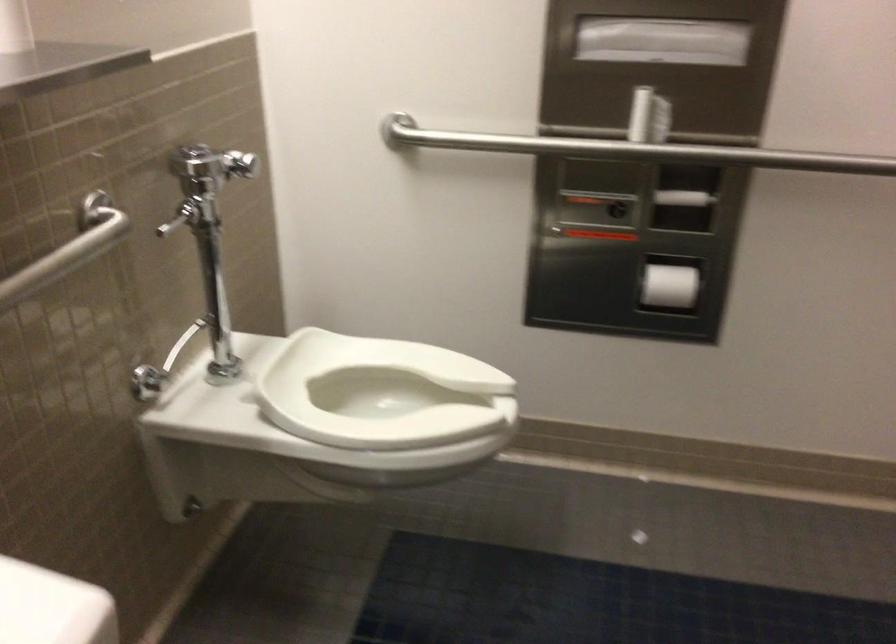
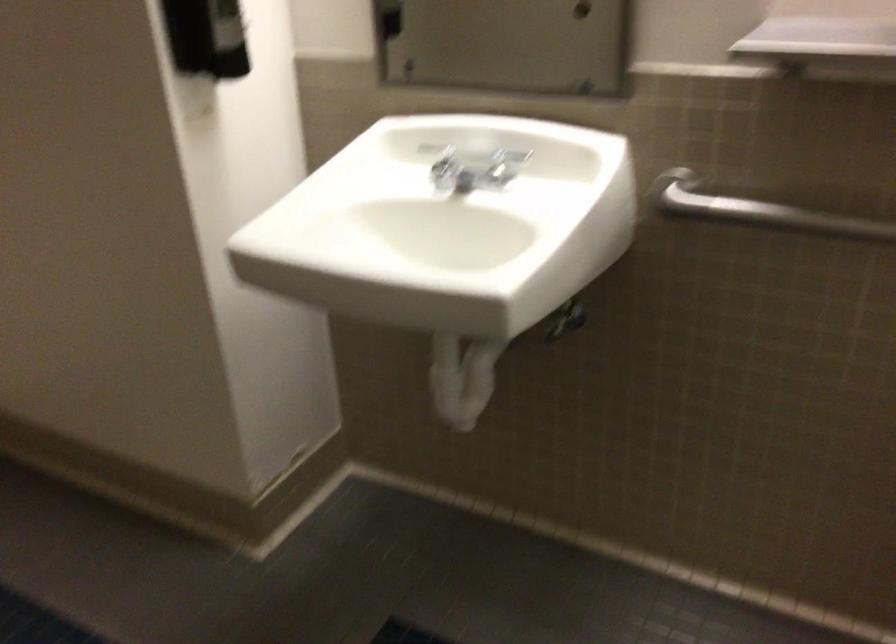
First-person continuous shooting, in which direction is the camera rotating?

The camera rotated toward left-down.